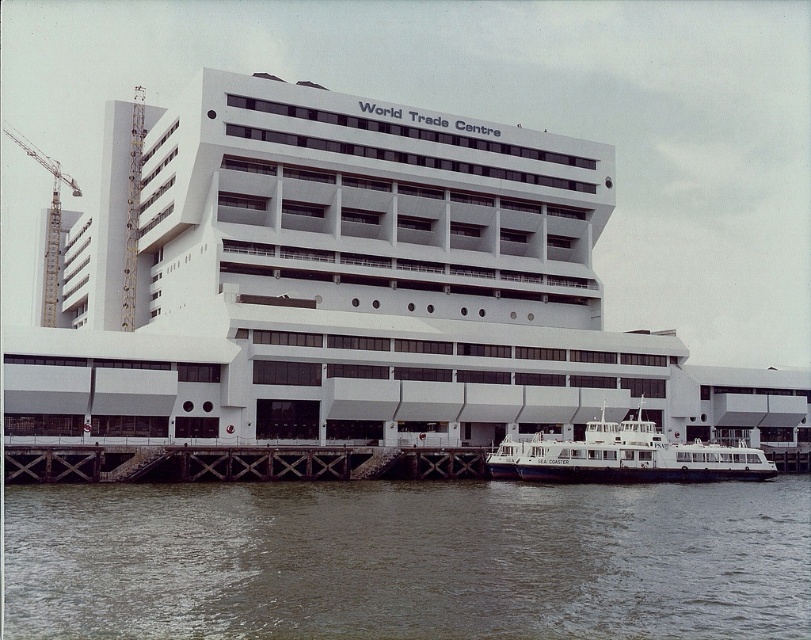
Question: Does white glossy boat at lower center come behind metallic construction crane at left?

Choices:
 (A) no
 (B) yes

Answer: (A)

Question: Which is nearer to the brown wooden dock at lower center?

Choices:
 (A) brown murky water at lower center
 (B) metallic construction crane at left
 (C) white matte cruise ship at lower right

Answer: (A)

Question: Is white matte cruise ship at lower right above brown wooden dock at lower center?

Choices:
 (A) no
 (B) yes

Answer: (B)

Question: Is brown wooden dock at lower center wider than metallic construction crane at left?

Choices:
 (A) yes
 (B) no

Answer: (B)

Question: Which is farther from the metallic construction crane at left?

Choices:
 (A) white matte cruise ship at lower right
 (B) brown wooden dock at lower center

Answer: (B)

Question: Among these objects, which one is nearest to the camera?

Choices:
 (A) white matte cruise ship at lower right
 (B) brown wooden dock at lower center
 (C) white glossy boat at lower center

Answer: (B)